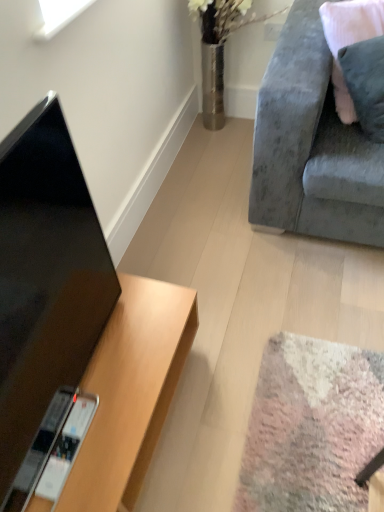
Where is `spots to the right of wooden desk at lower left`? spots to the right of wooden desk at lower left is located at coordinates pos(255,397).